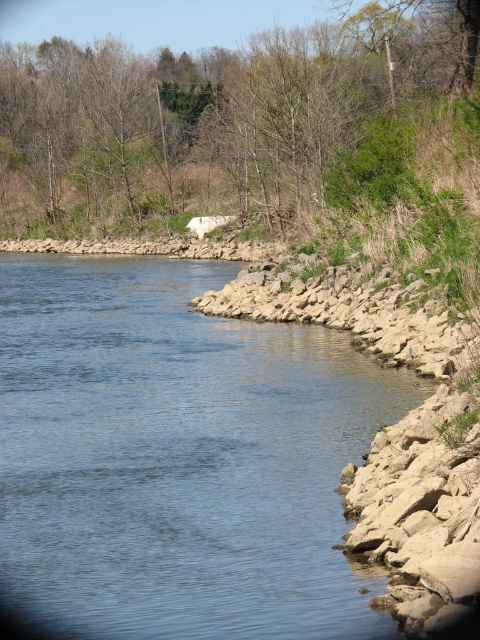
Question: In this image, where is blue stone river at lower right located relative to green leafy tree at upper center?

Choices:
 (A) right
 (B) left

Answer: (A)

Question: Which point is closer to the camera taking this photo?

Choices:
 (A) (271, 472)
 (B) (118, 176)

Answer: (A)

Question: Can you confirm if blue stone river at lower right is thinner than green leafy tree at upper center?

Choices:
 (A) no
 (B) yes

Answer: (B)

Question: Which object is closer to the camera taking this photo?

Choices:
 (A) green leafy tree at upper center
 (B) blue stone river at lower right

Answer: (B)

Question: Considering the relative positions of blue stone river at lower right and green leafy tree at upper center in the image provided, where is blue stone river at lower right located with respect to green leafy tree at upper center?

Choices:
 (A) left
 (B) right

Answer: (B)